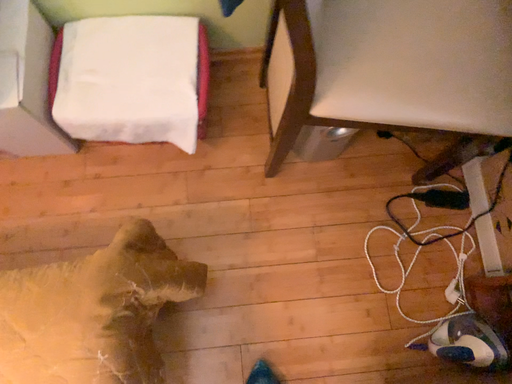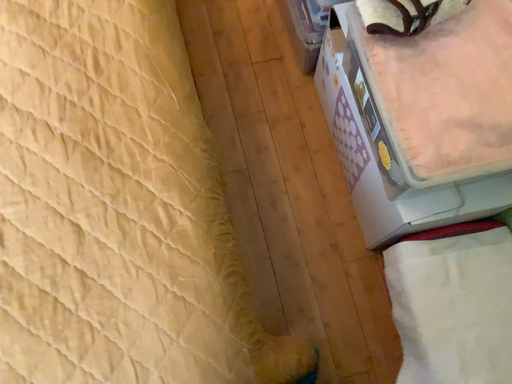
Question: Which way did the camera rotate in the video?

Choices:
 (A) rotated upward
 (B) rotated downward

Answer: (A)